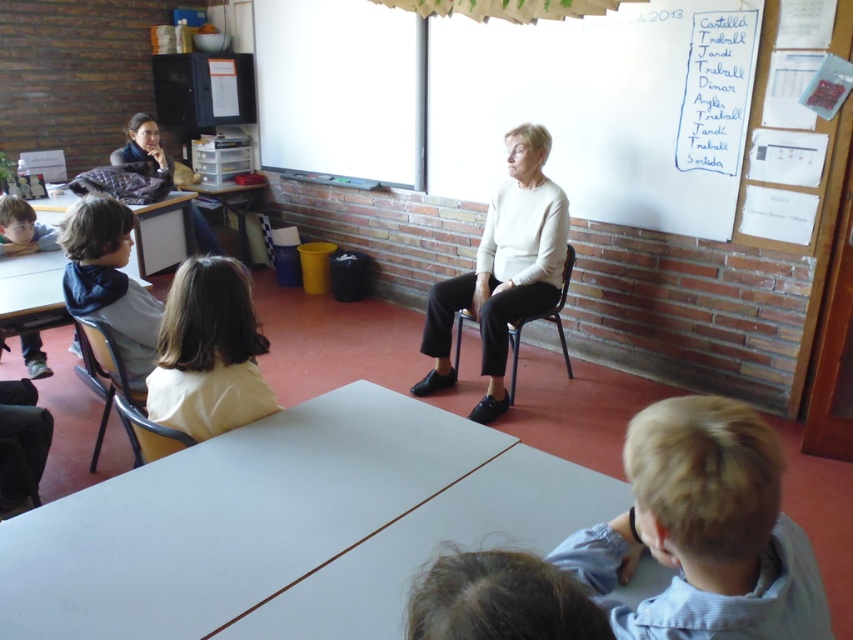
You are a photographer trying to capture a group photo of the children in the classroom. You want to ensure both the white matte shirt at center and the dark blue hoodie at left are clearly visible in the frame. Which child should you focus on first to include both clothing items in the photo?

The white matte shirt at center is positioned on the right side of dark blue hoodie at left. To include both in the frame, focus on the dark blue hoodie at left first, as it is closer to the left edge, ensuring the white matte shirt at center remains within the shot.